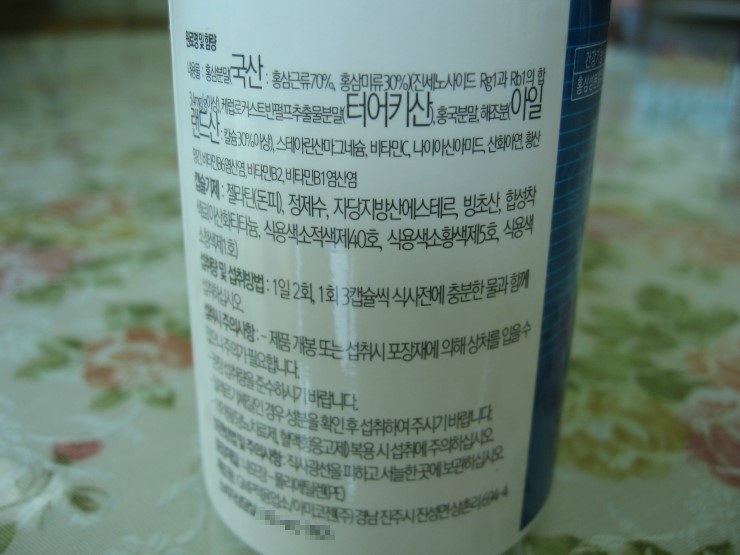
Identify the location of open space on countertop. The image size is (740, 555). (58, 77), (58, 249), (679, 117), (702, 259).